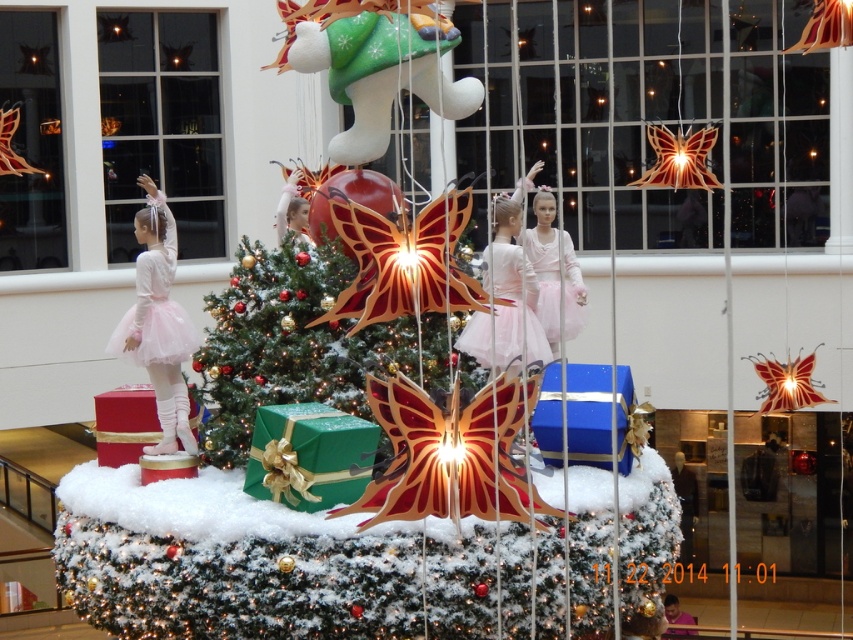
You are standing in front of the festive holiday display and want to take a photo. You notice two points marked in the scene. Which point is closer to you, point (692, 224) or point (204, 61)?

Point (692, 224) is closer to the viewer than point (204, 61).

You are a visitor at the holiday display and want to take a photo of the green paper christmas tree at center and the pink tulle ballet dancer at upper left. Which object should you focus on first if you want to capture both in a single frame without moving the camera?

You should focus on the green paper christmas tree at center first because it is located below the pink tulle ballet dancer at upper left, so adjusting the camera angle to include both would require framing from the lower object upwards.